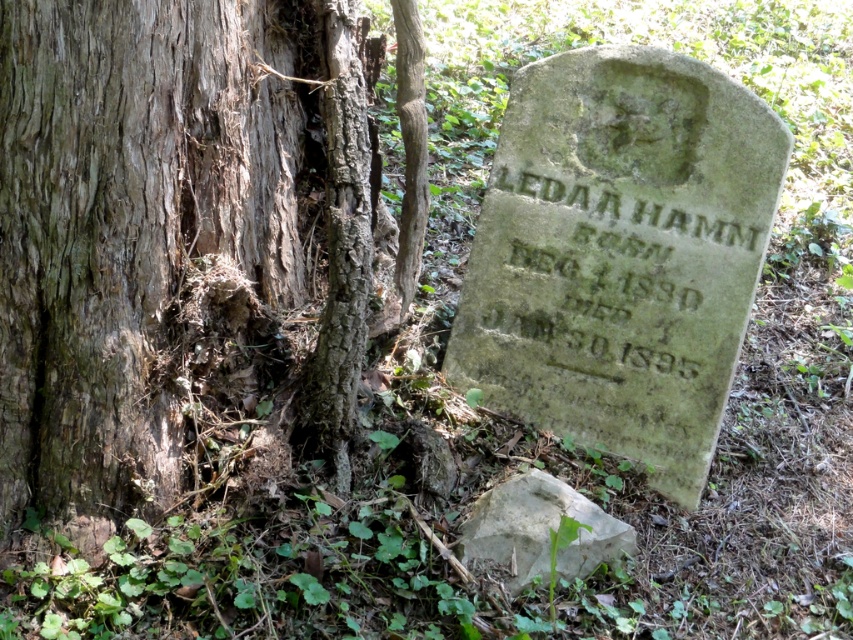
Question: Does brown rough bark tree trunk at left lie in front of white rough rock at lower center?

Choices:
 (A) yes
 (B) no

Answer: (A)

Question: Which of the following is the closest to the observer?

Choices:
 (A) brown rough bark tree trunk at left
 (B) white rough rock at lower center

Answer: (A)

Question: Considering the relative positions of brown rough bark tree trunk at left and white rough rock at lower center in the image provided, where is brown rough bark tree trunk at left located with respect to white rough rock at lower center?

Choices:
 (A) right
 (B) left

Answer: (B)

Question: Which point appears closest to the camera in this image?

Choices:
 (A) (189, 92)
 (B) (508, 580)

Answer: (A)

Question: Is brown rough bark tree trunk at left closer to the viewer compared to white rough rock at lower center?

Choices:
 (A) yes
 (B) no

Answer: (A)

Question: Which object is farther from the camera taking this photo?

Choices:
 (A) white rough rock at lower center
 (B) brown rough bark tree trunk at left

Answer: (A)